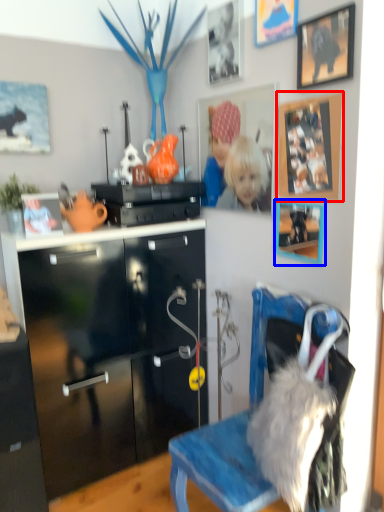
Question: Which of the following is the closest to the observer, picture frame (highlighted by a red box) or picture frame (highlighted by a blue box)?

Choices:
 (A) picture frame
 (B) picture frame

Answer: (A)